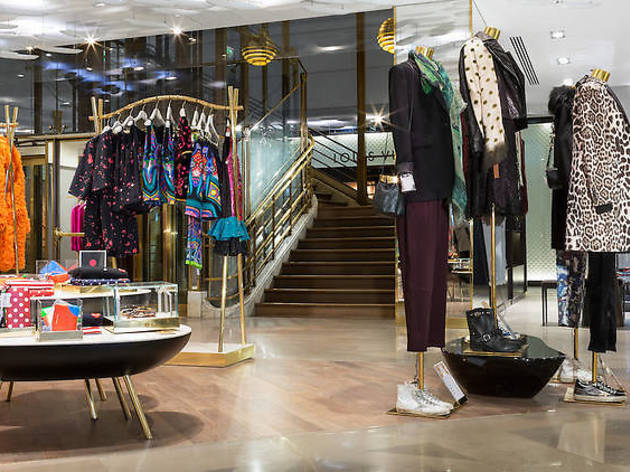
At what (x,y) coordinates should I click in order to perform the action: click on stairs. Please return your answer as a coordinate pair (x, y). This screenshot has width=630, height=472. Looking at the image, I should click on (352, 285), (335, 199).